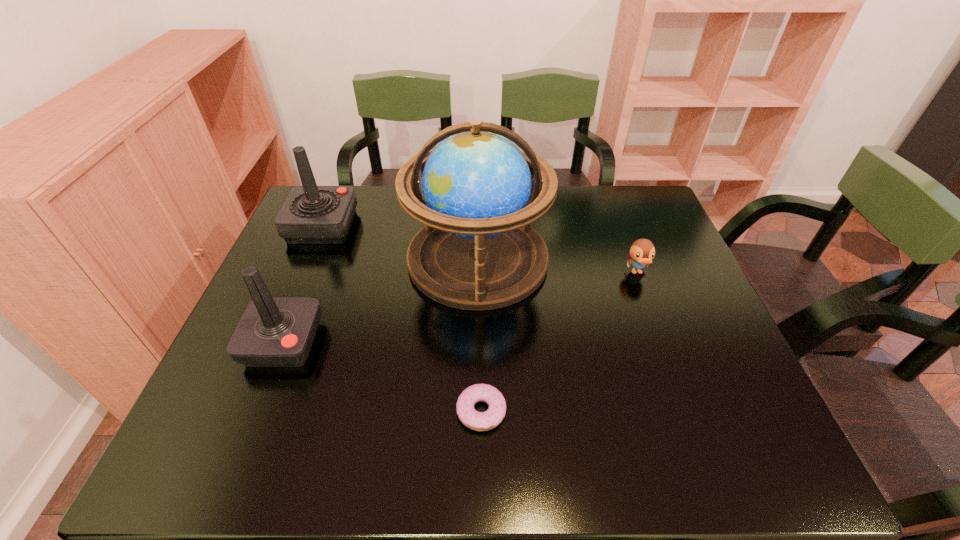
At what (x,y) coordinates should I click in order to perform the action: click on the tallest object. Please return your answer as a coordinate pair (x, y). This screenshot has height=540, width=960. Looking at the image, I should click on (477, 251).

Identify the location of the farther joystick. [x=311, y=214].

Locate an element on the screen. The width and height of the screenshot is (960, 540). the second nearest object is located at coordinates (274, 331).

Locate an element on the screen. The image size is (960, 540). the second shortest object is located at coordinates (642, 251).

You are a GUI agent. You are given a task and a screenshot of the screen. Output one action in this format:
    pyautogui.click(x=<x>, y=<y>)
    Task: Click on the duck
    The height and width of the screenshot is (540, 960).
    Given the screenshot: What is the action you would take?
    pyautogui.click(x=642, y=251)

This screenshot has width=960, height=540. What are the coordinates of `the shortest object` in the screenshot? It's located at (479, 421).

Locate an element on the screen. This screenshot has width=960, height=540. the nearest object is located at coordinates (479, 421).

Find the location of a particular element. vacant space situated 0.060m on the back of the tallest object is located at coordinates (478, 206).

Find the location of a particular element. The height and width of the screenshot is (540, 960). free region located on the front-facing side of the farther joystick is located at coordinates (483, 226).

Where is `free spot located on the right of the second nearest object`? free spot located on the right of the second nearest object is located at coordinates (492, 343).